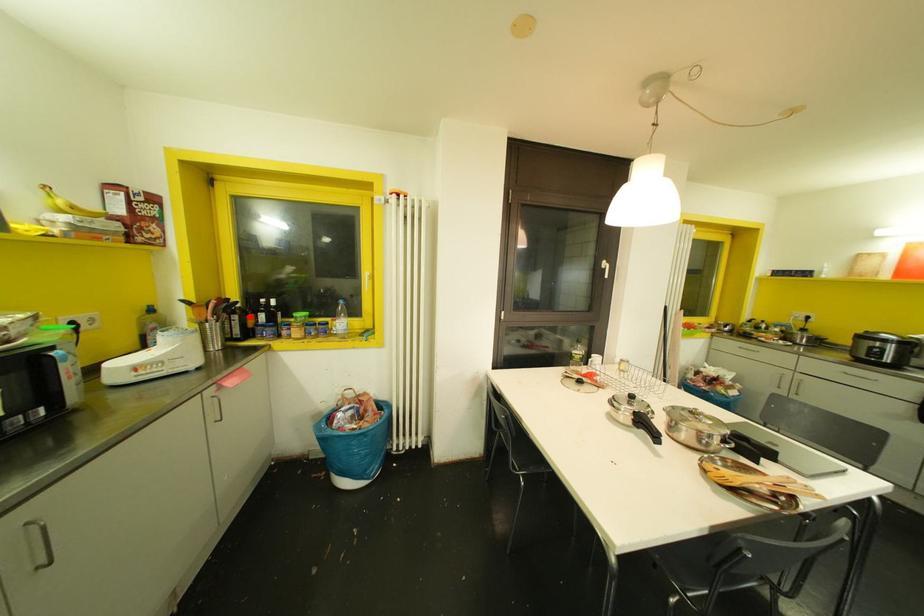
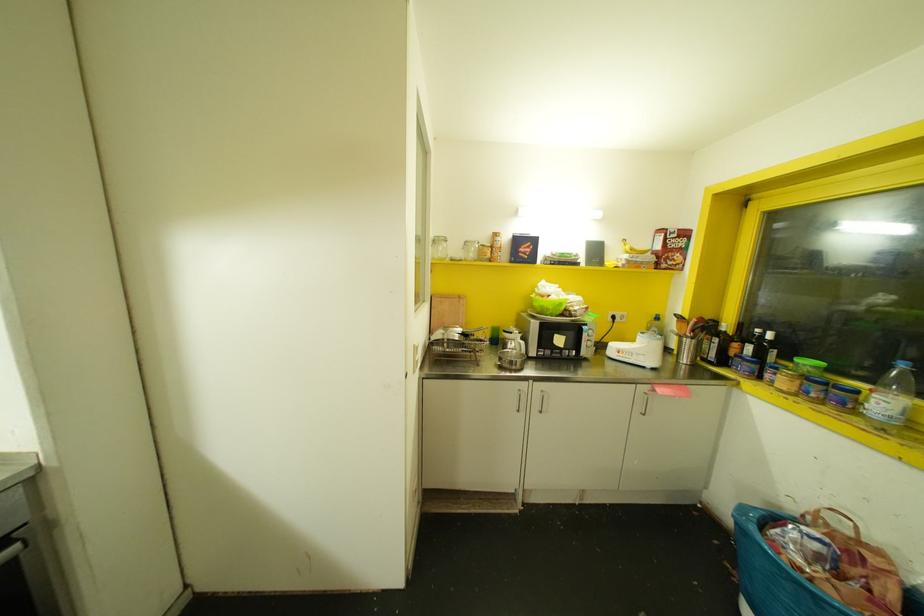
Where in the second image is the point corresponding to the highlighted location from the first image?

(735, 345)